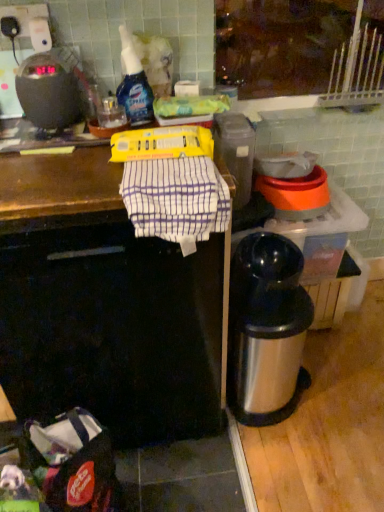
Question: Is point (119, 185) closer or farther from the camera than point (292, 393)?

Choices:
 (A) closer
 (B) farther

Answer: (A)

Question: Considering their positions, is white striped cloth at center located in front of or behind silver metallic thermos at lower right?

Choices:
 (A) front
 (B) behind

Answer: (A)

Question: Estimate the real-world distances between objects in this image. Which object is closer to the silver metallic thermos at lower right?

Choices:
 (A) white striped cloth at center
 (B) translucent plastic spray bottle at upper center
 (C) white striped cloth at center
 (D) black plastic scale at upper left

Answer: (A)

Question: Which object is the closest to the white striped cloth at center?

Choices:
 (A) silver metallic thermos at lower right
 (B) black plastic scale at upper left
 (C) white striped cloth at center
 (D) translucent plastic spray bottle at upper center

Answer: (C)